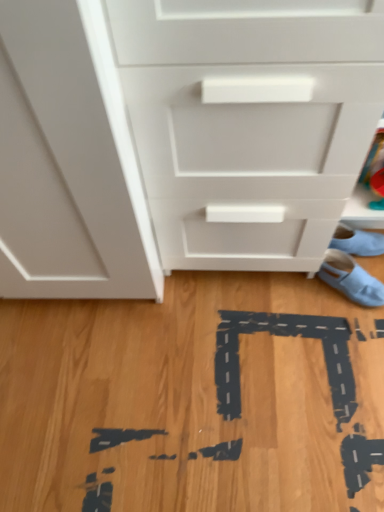
Question: From a real-world perspective, is light blue fabric shoe at lower right, which is counted as the 1th footwear, starting from the top, physically below light blue fabric shoe at lower right, the 2th footwear viewed from the top?

Choices:
 (A) yes
 (B) no

Answer: (B)

Question: Considering the relative sizes of light blue fabric shoe at lower right, marked as the second footwear in a bottom-to-top arrangement, and light blue fabric shoe at lower right, the 2th footwear viewed from the top, in the image provided, is light blue fabric shoe at lower right, marked as the second footwear in a bottom-to-top arrangement, smaller than light blue fabric shoe at lower right, the 2th footwear viewed from the top,?

Choices:
 (A) no
 (B) yes

Answer: (B)

Question: Is light blue fabric shoe at lower right, marked as the second footwear in a bottom-to-top arrangement, wider than light blue fabric shoe at lower right, which is counted as the 1th footwear, starting from the bottom?

Choices:
 (A) yes
 (B) no

Answer: (B)

Question: Is light blue fabric shoe at lower right, which is counted as the 1th footwear, starting from the top, oriented away from light blue fabric shoe at lower right, which is counted as the 1th footwear, starting from the bottom?

Choices:
 (A) no
 (B) yes

Answer: (A)

Question: Is light blue fabric shoe at lower right, which is counted as the 1th footwear, starting from the bottom, located within light blue fabric shoe at lower right, which is counted as the 1th footwear, starting from the top?

Choices:
 (A) no
 (B) yes

Answer: (A)

Question: Looking at their shapes, would you say white matte chest of drawers at center is wider or thinner than light blue fabric shoe at lower right, the 2th footwear viewed from the top?

Choices:
 (A) wide
 (B) thin

Answer: (A)

Question: From a real-world perspective, is white matte chest of drawers at center above or below light blue fabric shoe at lower right, which is counted as the 1th footwear, starting from the bottom?

Choices:
 (A) above
 (B) below

Answer: (A)

Question: From their relative heights in the image, would you say white matte chest of drawers at center is taller or shorter than light blue fabric shoe at lower right, which is counted as the 1th footwear, starting from the bottom?

Choices:
 (A) short
 (B) tall

Answer: (B)

Question: Relative to light blue fabric shoe at lower right, which is counted as the 1th footwear, starting from the bottom, is white matte chest of drawers at center in front or behind?

Choices:
 (A) front
 (B) behind

Answer: (A)

Question: Is light blue fabric shoe at lower right, which is counted as the 1th footwear, starting from the bottom, wider or thinner than white matte chest of drawers at center?

Choices:
 (A) thin
 (B) wide

Answer: (A)

Question: From their relative heights in the image, would you say light blue fabric shoe at lower right, which is counted as the 1th footwear, starting from the bottom, is taller or shorter than white matte chest of drawers at center?

Choices:
 (A) tall
 (B) short

Answer: (B)

Question: Is point (370, 283) positioned closer to the camera than point (92, 53)?

Choices:
 (A) closer
 (B) farther

Answer: (B)

Question: Looking at the image, does light blue fabric shoe at lower right, which is counted as the 1th footwear, starting from the bottom, seem bigger or smaller compared to white matte chest of drawers at center?

Choices:
 (A) small
 (B) big

Answer: (A)

Question: Is light blue fabric shoe at lower right, which is counted as the 1th footwear, starting from the bottom, wider or thinner than light blue fabric shoe at lower right, marked as the second footwear in a bottom-to-top arrangement?

Choices:
 (A) wide
 (B) thin

Answer: (A)

Question: Considering the positions of point (359, 269) and point (379, 246), is point (359, 269) closer or farther from the camera than point (379, 246)?

Choices:
 (A) closer
 (B) farther

Answer: (A)